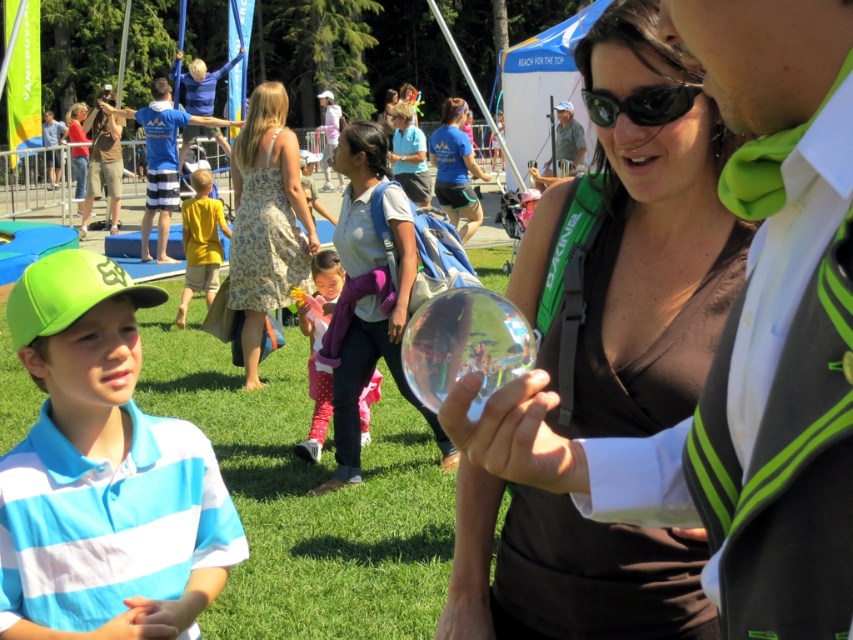
Find the location of a particular element. blue t-shirt at center is located at coordinates (456, 168).

In the scene shown: Which is more to the right, blue t-shirt at center or green reflective sunglasses at center?

Positioned to the right is green reflective sunglasses at center.

Is point (438, 196) closer to viewer compared to point (598, 106)?

No, it is behind (598, 106).

Find the location of `blue t-shirt at center`. blue t-shirt at center is located at coordinates (456, 168).

Does green satin bow tie at center appear over blue t-shirt at center?

No, green satin bow tie at center is not above blue t-shirt at center.

Measure the distance between point (722, 365) and camera.

Point (722, 365) is 1.34 meters away from camera.

What do you see at coordinates (784, 454) in the screenshot?
I see `green satin bow tie at center` at bounding box center [784, 454].

Identify the location of green satin bow tie at center. (784, 454).

Between yellow cotton shirt at center and blue striped polo shirt at left, which one is positioned higher?

blue striped polo shirt at left

Does yellow cotton shirt at center come behind blue striped polo shirt at left?

No, it is not.

Where is `yellow cotton shirt at center`? Image resolution: width=853 pixels, height=640 pixels. yellow cotton shirt at center is located at coordinates (201, 243).

Image resolution: width=853 pixels, height=640 pixels. I want to click on yellow cotton shirt at center, so click(201, 243).